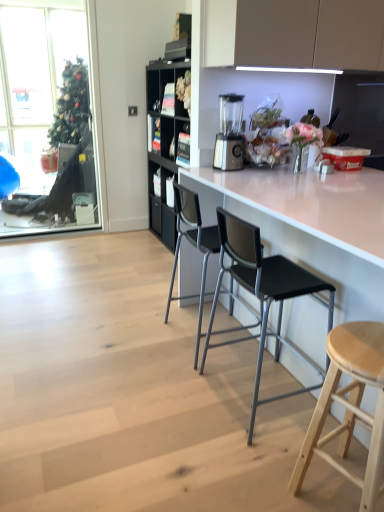
Find the location of `free space to the left of black plastic chair at center, the second chair from the back`. free space to the left of black plastic chair at center, the second chair from the back is located at coordinates (161, 396).